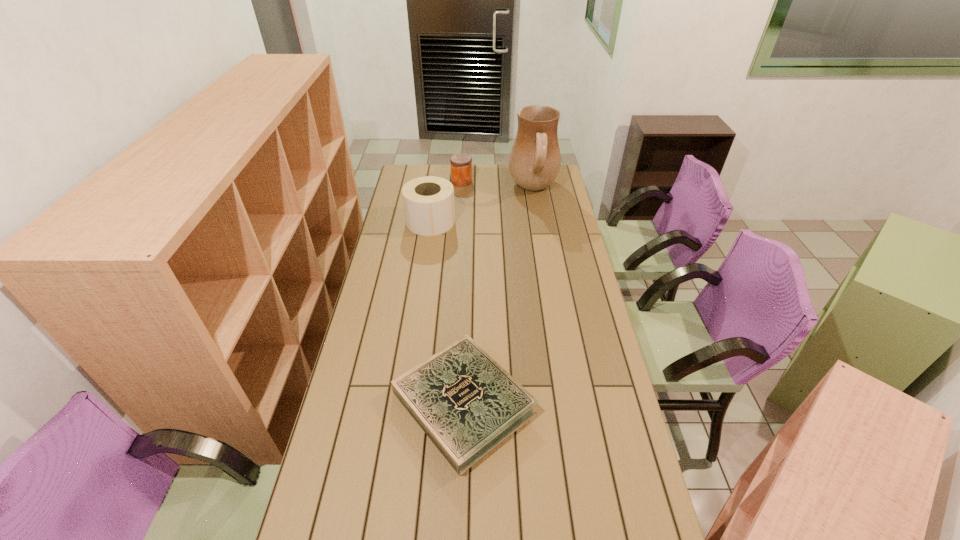
Where is `the tallest object`? This screenshot has width=960, height=540. the tallest object is located at coordinates (535, 159).

What are the coordinates of `the third shortest object` in the screenshot? It's located at (428, 201).

In order to click on jar in this screenshot , I will do `click(461, 164)`.

Where is `the nearest object`? This screenshot has width=960, height=540. the nearest object is located at coordinates (466, 403).

The image size is (960, 540). In order to click on the shortest object in this screenshot , I will do click(466, 403).

Locate an element on the screen. Image resolution: width=960 pixels, height=540 pixels. free space located 0.350m at the spout of the cream pitcher is located at coordinates (443, 190).

The height and width of the screenshot is (540, 960). I want to click on vacant space located 0.230m at the spout of the cream pitcher, so click(x=465, y=190).

Image resolution: width=960 pixels, height=540 pixels. Find the location of `free space located 0.300m at the spout of the cream pitcher`. free space located 0.300m at the spout of the cream pitcher is located at coordinates (451, 190).

You are a GUI agent. You are given a task and a screenshot of the screen. Output one action in this format:
    pyautogui.click(x=<x>, y=<y>)
    Task: Click on the free space located on the front of the third shortest object
    
    Given the screenshot: What is the action you would take?
    pyautogui.click(x=425, y=257)

Where is `vacant space situated on the right of the third tallest object`? vacant space situated on the right of the third tallest object is located at coordinates (509, 181).